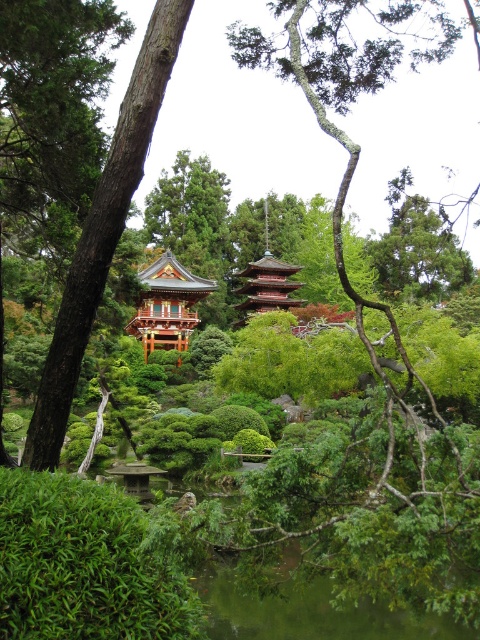
Does point (19, 612) come in front of point (142, 86)?

Yes, it is.

The image size is (480, 640). What do you see at coordinates (83, 564) in the screenshot? I see `green leafy bush at lower left` at bounding box center [83, 564].

The height and width of the screenshot is (640, 480). In order to click on green leafy bush at lower left in this screenshot , I will do `click(83, 564)`.

Who is lower down, green textured tree at center or shiny gold pagoda at center?

shiny gold pagoda at center is lower down.

Is point (156, 45) positioned behind point (176, 330)?

No.

Image resolution: width=480 pixels, height=640 pixels. Find the location of `green textured tree at center`. green textured tree at center is located at coordinates (104, 230).

Is green leafy bush at lower left smaller than reddish-brown wooden pagoda at center?

Yes, green leafy bush at lower left is smaller than reddish-brown wooden pagoda at center.

At what (x,y) coordinates should I click in order to perform the action: click on green leafy bush at lower left. Please return your answer as a coordinate pair (x, y). The width and height of the screenshot is (480, 640). Looking at the image, I should click on (83, 564).

Describe the element at coordinates (83, 564) in the screenshot. This screenshot has width=480, height=640. I see `green leafy bush at lower left` at that location.

Identify the location of green leafy bush at lower left. This screenshot has height=640, width=480. (83, 564).